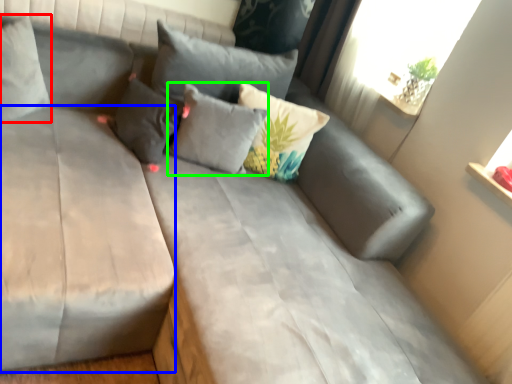
Question: Which is nearer to the pillow (highlighted by a red box)? mattress (highlighted by a blue box) or pillow (highlighted by a green box).

Choices:
 (A) mattress
 (B) pillow

Answer: (A)